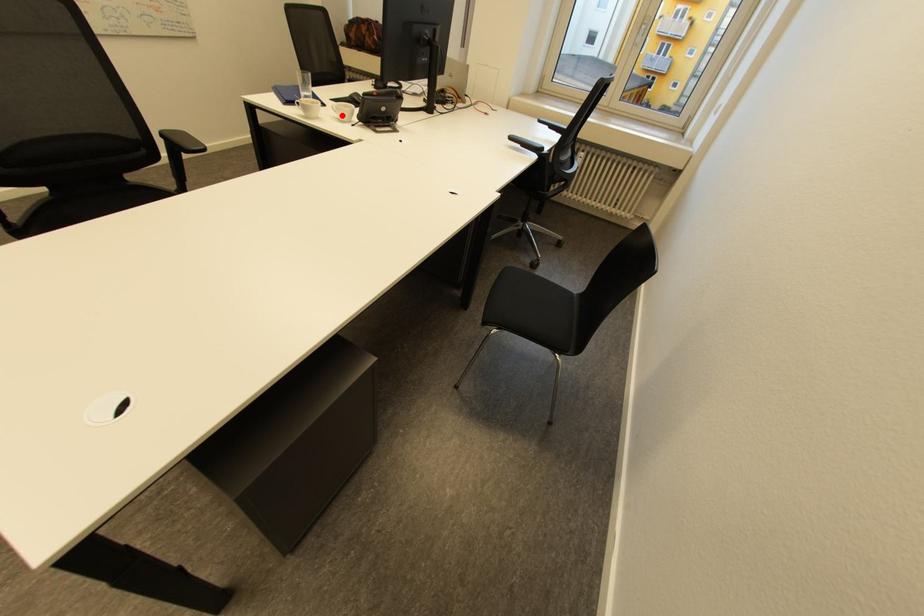
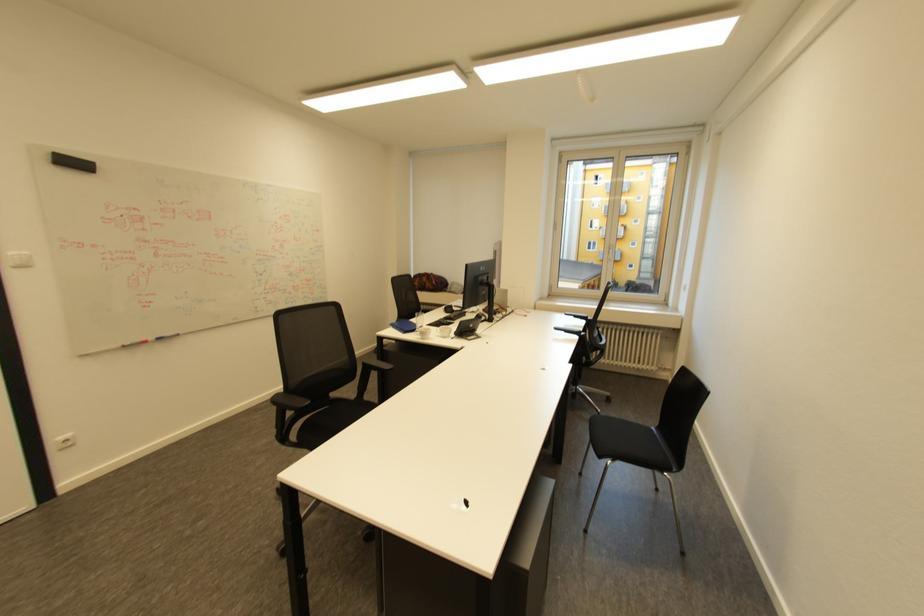
Question: I am providing you with two images of the same scene from different viewpoints. In image1, a red point is highlighted. Considering the same 3D point in image2, which of the following is correct?

Choices:
 (A) It is closer
 (B) It is farther

Answer: (B)